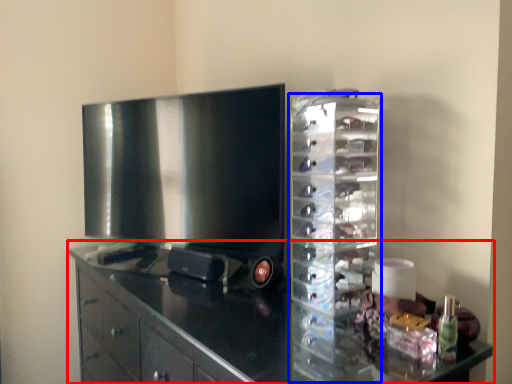
Question: Which object appears closest to the camera in this image, cabinetry (highlighted by a red box) or glass box (highlighted by a blue box)?

Choices:
 (A) cabinetry
 (B) glass box

Answer: (A)